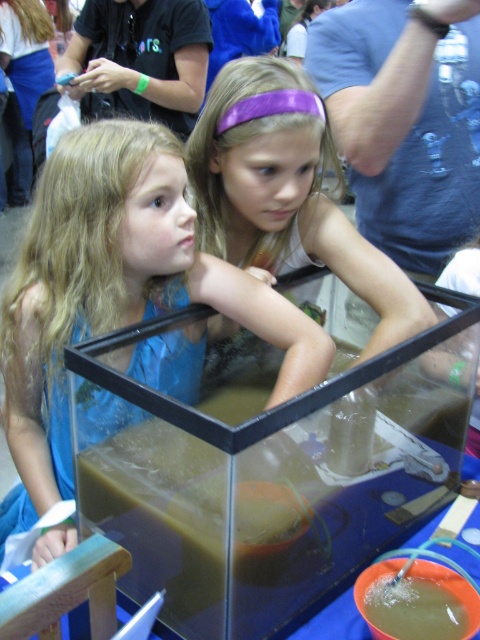
Question: Which of these objects is positioned closest to the blue fabric dress at left?

Choices:
 (A) purple shiny headband at upper center
 (B) transparent glass tank at center

Answer: (B)

Question: Which of the following is the closest to the observer?

Choices:
 (A) (241, 515)
 (B) (96, 221)
 (C) (252, 168)

Answer: (A)

Question: Is transparent glass tank at center to the left of blue fabric dress at left from the viewer's perspective?

Choices:
 (A) no
 (B) yes

Answer: (A)

Question: Which point is farther from the camera taking this photo?

Choices:
 (A) (241, 500)
 (B) (217, 234)
 (C) (54, 376)

Answer: (B)

Question: Can you confirm if transparent glass tank at center is smaller than purple shiny headband at upper center?

Choices:
 (A) no
 (B) yes

Answer: (A)

Question: Can you confirm if blue fabric dress at left is thinner than purple shiny headband at upper center?

Choices:
 (A) yes
 (B) no

Answer: (B)